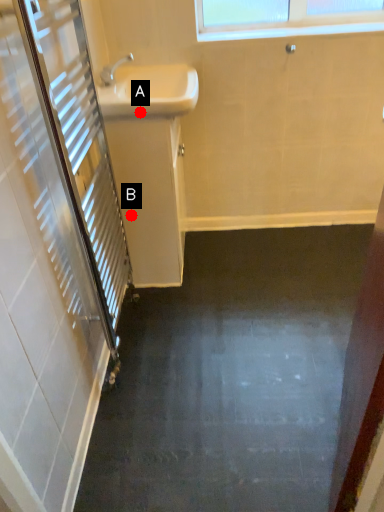
Question: Two points are circled on the image, labeled by A and B beside each circle. Which point is further to the camera?

Choices:
 (A) A is further
 (B) B is further

Answer: (B)